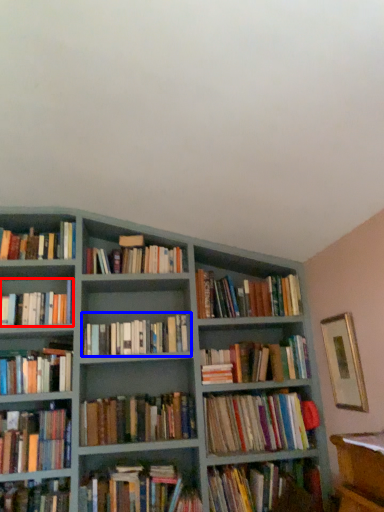
Question: Which object appears closest to the camera in this image, book (highlighted by a red box) or book (highlighted by a blue box)?

Choices:
 (A) book
 (B) book

Answer: (A)